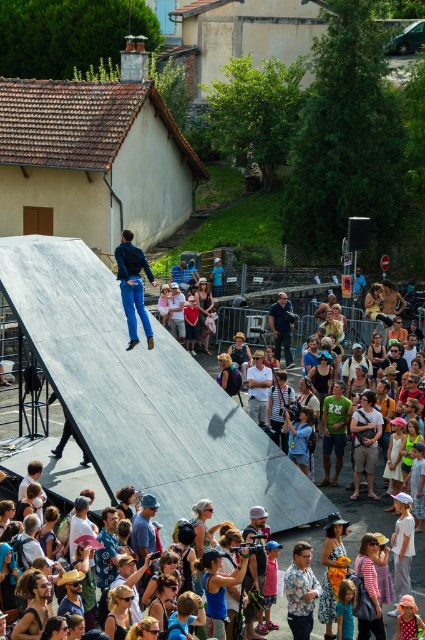
Between smooth gray ramp at center and denim shorts at center, which one has less height?

Standing shorter between the two is denim shorts at center.

Between smooth gray ramp at center and denim shorts at center, which one has more height?

With more height is smooth gray ramp at center.

Which is behind, point (176, 480) or point (206, 316)?

Point (206, 316)

Identify the location of smooth gray ramp at center. This screenshot has width=425, height=640. (144, 396).

Is blue fabric tank top at center closer to the viewer compared to green jersey at center?

Yes, it is.

Does blue fabric tank top at center appear on the left side of green jersey at center?

Correct, you'll find blue fabric tank top at center to the left of green jersey at center.

Does point (215, 625) lie in front of point (328, 403)?

Yes, it is.

Where is `blue fabric tank top at center`? blue fabric tank top at center is located at coordinates (218, 588).

Measure the distance between floral shirt at lower center and camera.

29.28 meters

Which of these two, floral shirt at lower center or blue fabric tank top at center, stands taller?

floral shirt at lower center is taller.

Who is more distant from viewer, (303, 545) or (240, 573)?

Point (303, 545)

Locate an element on the screen. floral shirt at lower center is located at coordinates (300, 592).